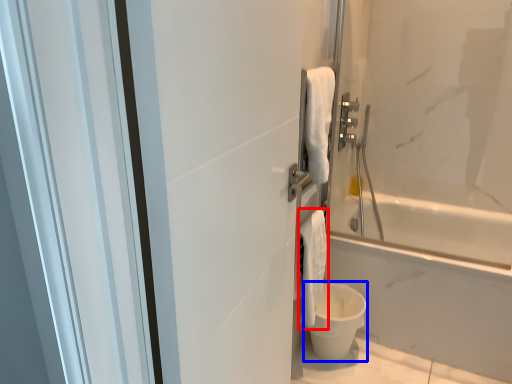
Question: Which of the following is the farthest to the observer, bath towel (highlighted by a red box) or toilet bowl (highlighted by a blue box)?

Choices:
 (A) bath towel
 (B) toilet bowl

Answer: (B)